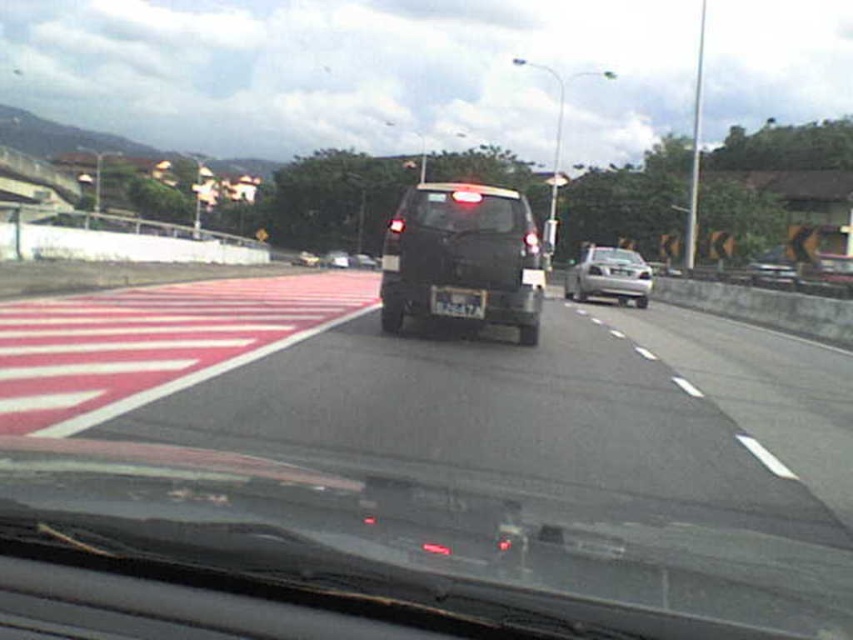
Question: Can you confirm if transparent plastic windshield at center is smaller than silver metallic sedan at center?

Choices:
 (A) yes
 (B) no

Answer: (A)

Question: Which point is farther from the camera taking this photo?

Choices:
 (A) click(x=453, y=296)
 (B) click(x=426, y=204)
 (C) click(x=436, y=195)
 (D) click(x=326, y=252)

Answer: (D)

Question: Which of these objects is positioned closest to the black plastic license plate at center?

Choices:
 (A) silver metallic sedan at center
 (B) metallic silver sedan at right
 (C) black matte suv at center

Answer: (A)

Question: Does silver metallic sedan at center appear over metallic silver sedan at right?

Choices:
 (A) no
 (B) yes

Answer: (B)

Question: Estimate the real-world distances between objects in this image. Which object is closer to the black matte suv at center?

Choices:
 (A) metallic silver sedan at right
 (B) silver metallic sedan at center

Answer: (B)

Question: Does transparent plastic windshield at center have a smaller size compared to matte black suv at center?

Choices:
 (A) yes
 (B) no

Answer: (A)